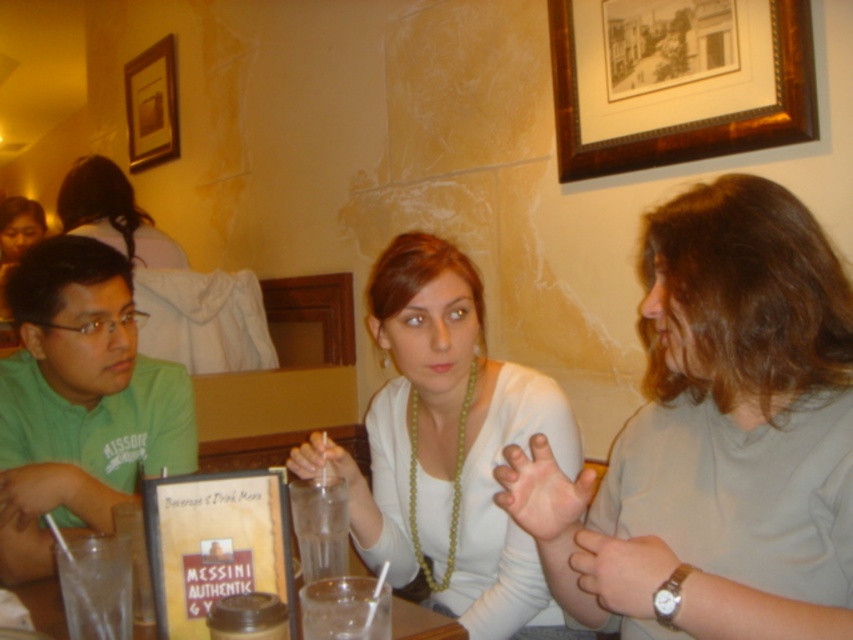
You are a server in this restaurant and need to place a new menu holder on the table. The existing menu holder is already at the center. Where should you place the new menu holder to avoid overlapping with the white matte necklace at center?

The white matte necklace at center is located at point (x=453, y=448), so you should place the new menu holder away from that coordinate to avoid overlapping.

You are a customer at the restaurant and want to check both the white matte necklace at center and the green matte shirt at left. Which one can you see more clearly?

The white matte necklace at center is closer to the viewer than the green matte shirt at left, so you can see the white matte necklace at center more clearly.